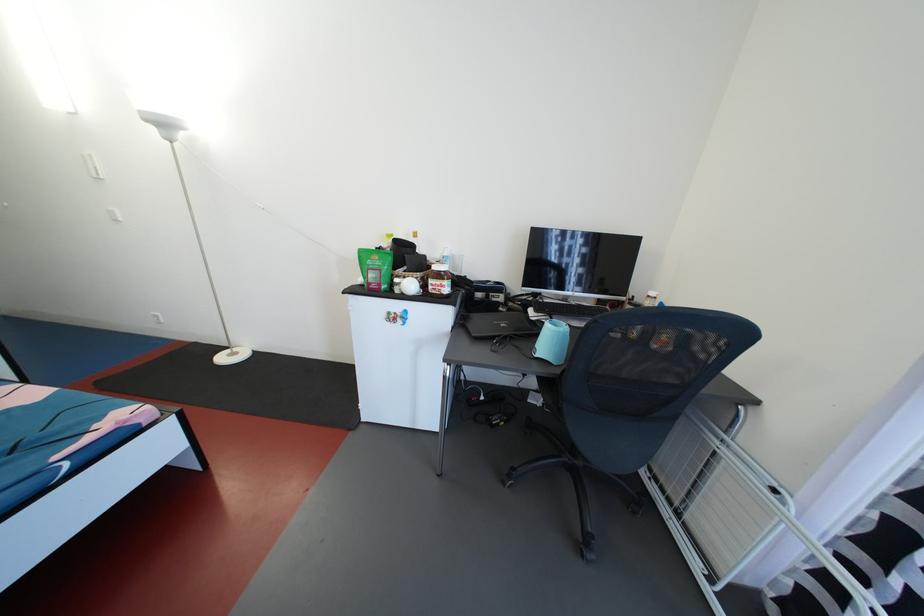
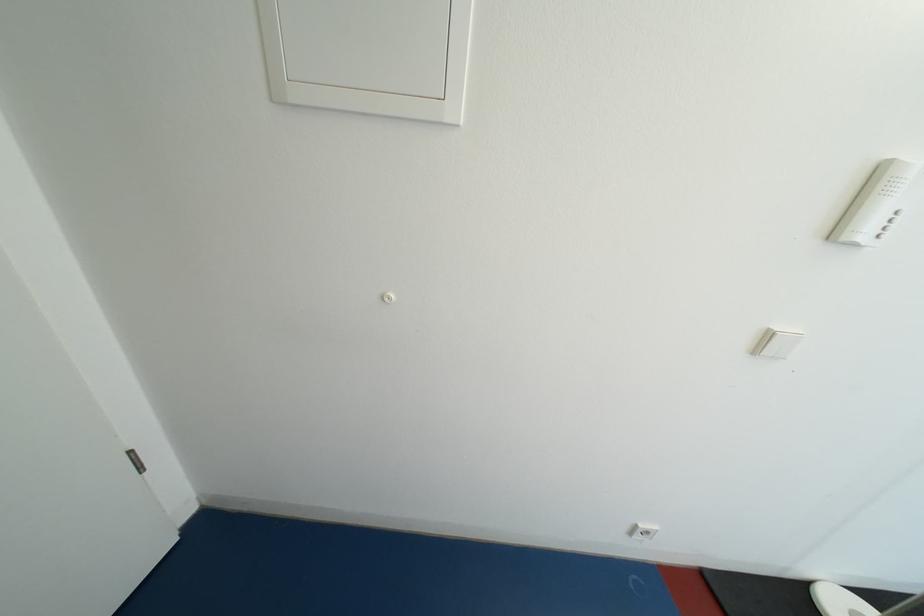
Which direction would the cameraman need to move to produce the second image?

The cameraman walked toward left, forward.